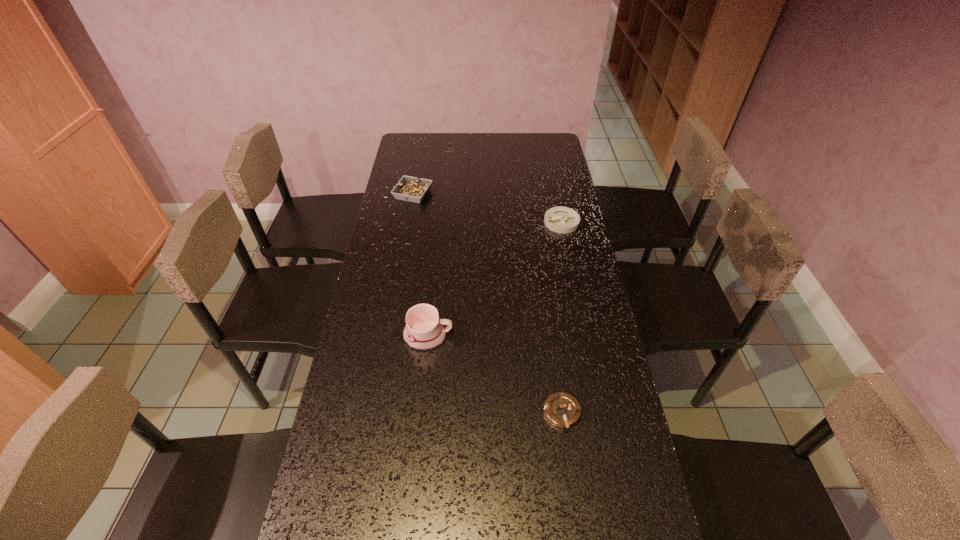
At what (x,y) coordinates should I click in order to perform the action: click on the second nearest object. Please return your answer as a coordinate pair (x, y). Image resolution: width=960 pixels, height=540 pixels. Looking at the image, I should click on (424, 331).

The height and width of the screenshot is (540, 960). I want to click on the tallest object, so click(x=424, y=331).

The image size is (960, 540). I want to click on the leftmost ashtray, so click(x=411, y=189).

Find the location of `the farthest ashtray`. the farthest ashtray is located at coordinates (411, 189).

The height and width of the screenshot is (540, 960). Find the location of `the third nearest object`. the third nearest object is located at coordinates (560, 219).

I want to click on the shortest ashtray, so click(x=561, y=409).

Where is `the nearest object`? Image resolution: width=960 pixels, height=540 pixels. the nearest object is located at coordinates (561, 409).

This screenshot has width=960, height=540. I want to click on free space located on the side with the handle of the mug, so click(486, 336).

Image resolution: width=960 pixels, height=540 pixels. I want to click on blank space located 0.350m on the back of the farthest object, so click(422, 142).

The width and height of the screenshot is (960, 540). In order to click on vacant space located on the left of the third nearest object in this screenshot , I will do `click(462, 222)`.